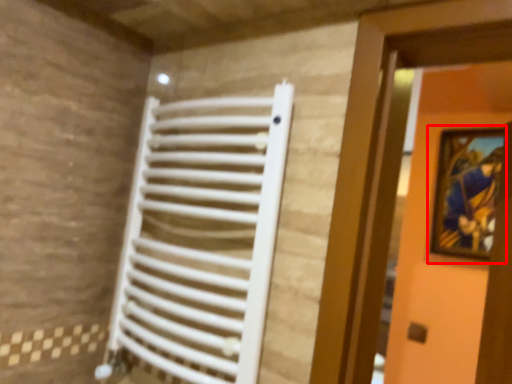
Question: Where is picture frame (annotated by the red box) located in relation to radiator in the image?

Choices:
 (A) right
 (B) left

Answer: (A)